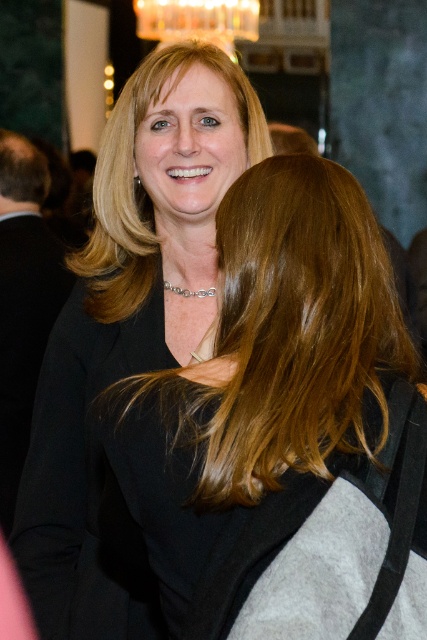
Does blonde hair at center have a lesser height compared to blonde smooth hair at upper center?

Yes, blonde hair at center is shorter than blonde smooth hair at upper center.

Does blonde hair at center have a smaller size compared to blonde smooth hair at upper center?

Yes.

Does point (269, 204) come farther from viewer compared to point (102, 291)?

No.

At what (x,y) coordinates should I click in order to perform the action: click on blonde hair at center. Please return your answer as a coordinate pair (x, y). This screenshot has width=427, height=640. Looking at the image, I should click on point(297,326).